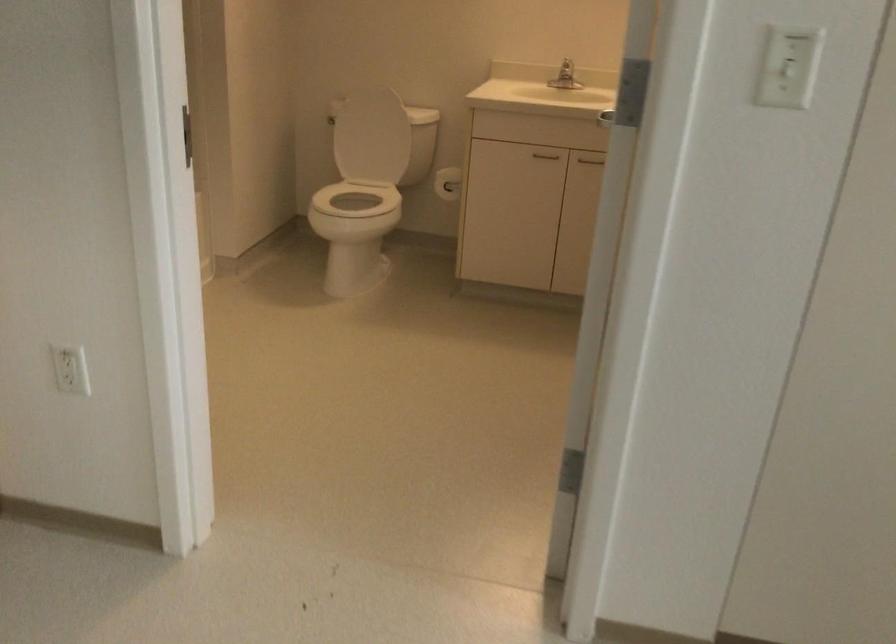
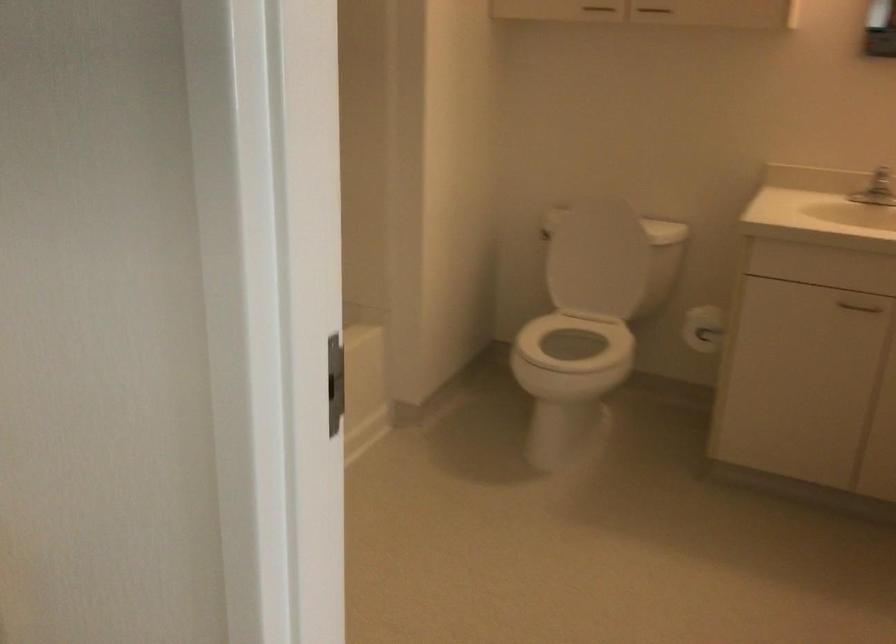
Find the pixel in the second image that matches (x=454, y=181) in the first image.

(702, 328)